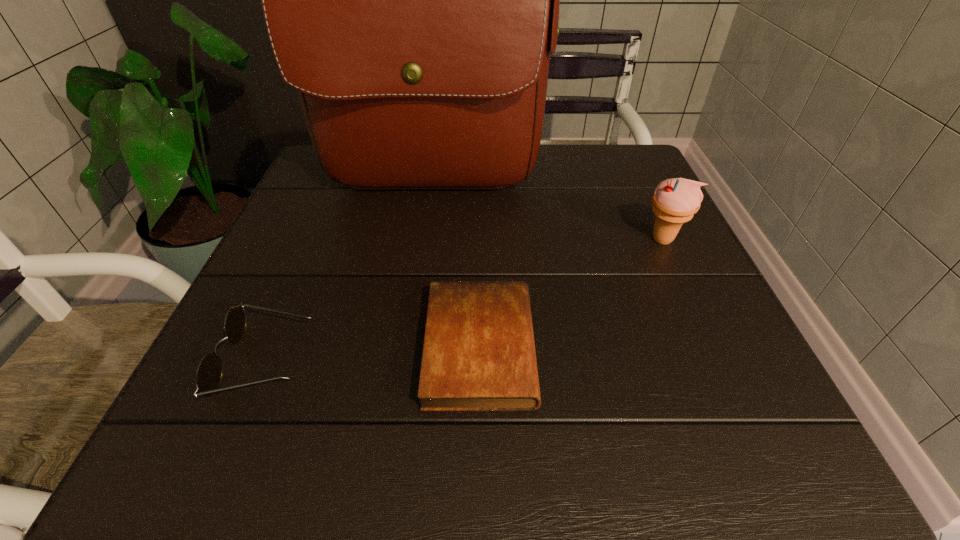
Locate an element on the screen. The width and height of the screenshot is (960, 540). free point between the shortest object and the spectacles is located at coordinates (373, 354).

The width and height of the screenshot is (960, 540). Find the location of `vacant area that lies between the tallest object and the spectacles`. vacant area that lies between the tallest object and the spectacles is located at coordinates (348, 274).

Point out which object is positioned as the third nearest to the shortest object. Please provide its 2D coordinates. Your answer should be formatted as a tuple, i.e. [(x, y)], where the tuple contains the x and y coordinates of a point satisfying the conditions above.

[(675, 201)]

The image size is (960, 540). I want to click on the closest object relative to the Bible, so coord(209,373).

I want to click on free spot that satisfies the following two spatial constraints: 1. on the open flap of the tallest object; 2. on the front-facing side of the spectacles, so click(406, 361).

You are a GUI agent. You are given a task and a screenshot of the screen. Output one action in this format:
    pyautogui.click(x=<x>, y=<y>)
    Task: Click on the blank area in the image that satisfies the following two spatial constraints: 1. on the open flap of the tallest object; 2. on the front-facing side of the second shortest object
    
    Given the screenshot: What is the action you would take?
    pyautogui.click(x=406, y=361)